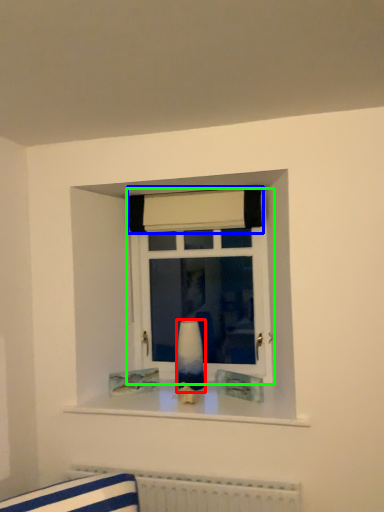
Question: Which object is the closest to the vase (highlighted by a red box)? Choose among these: curtain (highlighted by a blue box) or window (highlighted by a green box).

Choices:
 (A) curtain
 (B) window

Answer: (B)